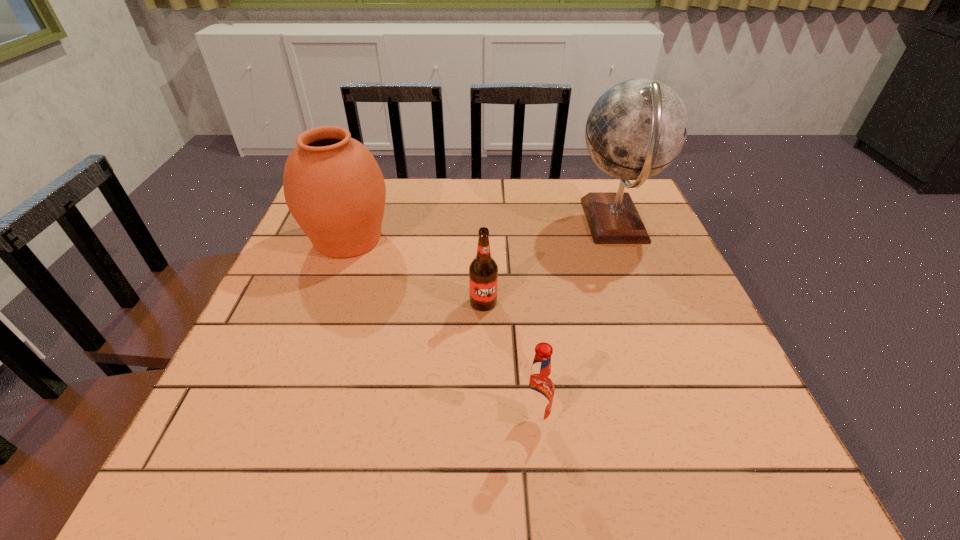
I want to click on object at the far right corner, so click(x=637, y=128).

In the image, there is a desktop. At what (x,y) coordinates should I click in order to perform the action: click on vacant space at the far edge. Please return your answer as a coordinate pair (x, y). This screenshot has height=540, width=960. Looking at the image, I should click on (411, 180).

Where is `vacant space at the near edge of the desktop`? This screenshot has width=960, height=540. vacant space at the near edge of the desktop is located at coordinates (601, 445).

Locate an element on the screen. This screenshot has height=540, width=960. vacant space at the left edge of the desktop is located at coordinates (301, 389).

Identify the location of vacant space at the right edge. This screenshot has height=540, width=960. (706, 339).

This screenshot has height=540, width=960. I want to click on free area in between the urn and the left root beer, so click(x=416, y=271).

Find the location of a particular element. The width and height of the screenshot is (960, 540). unoccupied position between the leftmost object and the right root beer is located at coordinates (441, 329).

At what (x,y) coordinates should I click in order to perform the action: click on vacant area that lies between the nearest object and the third object from right to left. Please return your answer as a coordinate pair (x, y). The height and width of the screenshot is (540, 960). Looking at the image, I should click on (509, 361).

You are a GUI agent. You are given a task and a screenshot of the screen. Output one action in this format:
    pyautogui.click(x=<x>, y=<y>)
    Task: Click on the blank region between the nearest object and the urn
    
    Given the screenshot: What is the action you would take?
    pyautogui.click(x=441, y=329)

At what (x,y) coordinates should I click in order to perform the action: click on unoccupied position between the rightmost object and the third object from right to left. Please return your answer as a coordinate pair (x, y). The image size is (960, 540). Looking at the image, I should click on (549, 262).